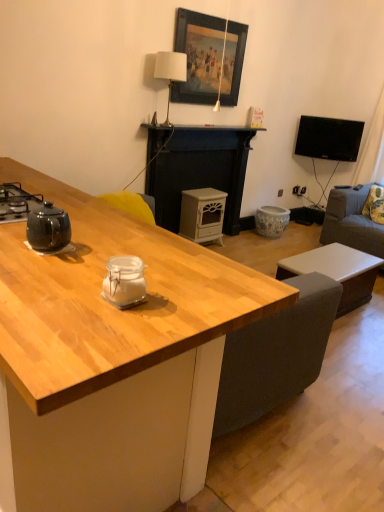
At what (x,y) coordinates should I click in order to perform the action: click on vacant space to the right of clear glass jar at center, the 2th appliance when ordered from right to left. Please return your answer as a coordinate pair (x, y). This screenshot has height=512, width=384. Looking at the image, I should click on (191, 302).